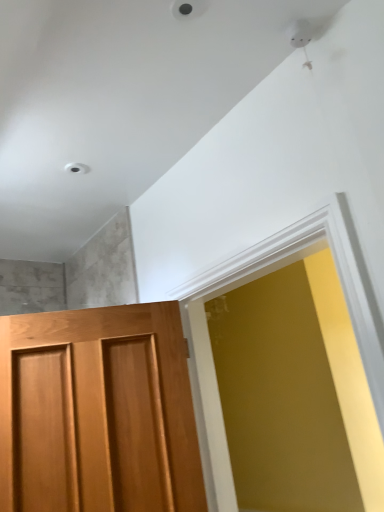
Question: Considering the positions of wooden door at left and matte white frame at center in the image, is wooden door at left taller or shorter than matte white frame at center?

Choices:
 (A) tall
 (B) short

Answer: (B)

Question: Looking at the image, does wooden door at left seem bigger or smaller compared to matte white frame at center?

Choices:
 (A) big
 (B) small

Answer: (B)

Question: Based on their positions, is wooden door at left located to the left or right of matte white frame at center?

Choices:
 (A) right
 (B) left

Answer: (B)

Question: In terms of height, does matte white frame at center look taller or shorter compared to wooden door at left?

Choices:
 (A) tall
 (B) short

Answer: (A)

Question: From the image's perspective, relative to wooden door at left, is matte white frame at center above or below?

Choices:
 (A) below
 (B) above

Answer: (B)

Question: Is matte white frame at center spatially inside wooden door at left, or outside of it?

Choices:
 (A) inside
 (B) outside

Answer: (B)

Question: From a real-world perspective, is matte white frame at center physically located above or below wooden door at left?

Choices:
 (A) below
 (B) above

Answer: (B)